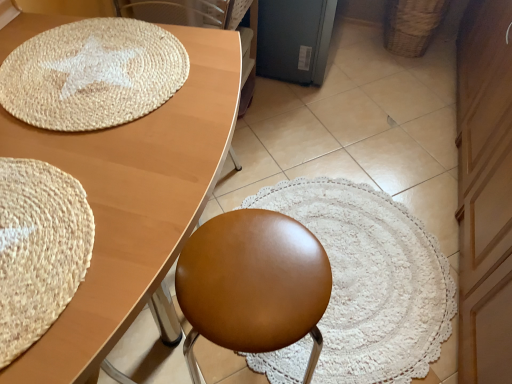
Question: Looking at the image, does brown leather swivel chair at upper center seem bigger or smaller compared to beige woven mat at lower left, the 1th mat in the front-to-back sequence?

Choices:
 (A) big
 (B) small

Answer: (A)

Question: Considering the positions of brown leather swivel chair at upper center and beige woven mat at lower left, arranged as the 1th mat when ordered from the bottom, in the image, is brown leather swivel chair at upper center taller or shorter than beige woven mat at lower left, arranged as the 1th mat when ordered from the bottom,?

Choices:
 (A) short
 (B) tall

Answer: (B)

Question: Which object is the closest to the satin brown stool at center?

Choices:
 (A) beige woven mat at lower left, the second mat from the top
 (B) matte wood table at upper left
 (C) brown leather swivel chair at upper center
 (D) natural fiber mat at upper left, which is the second mat in front-to-back order
 (E) wooden dresser at right

Answer: (B)

Question: Which of these objects is positioned farthest from the brown leather swivel chair at upper center?

Choices:
 (A) matte wood table at upper left
 (B) natural fiber mat at upper left, which ranks as the second mat in bottom-to-top order
 (C) beige woven mat at lower left, the second mat from the top
 (D) wooden dresser at right
 (E) satin brown stool at center

Answer: (D)